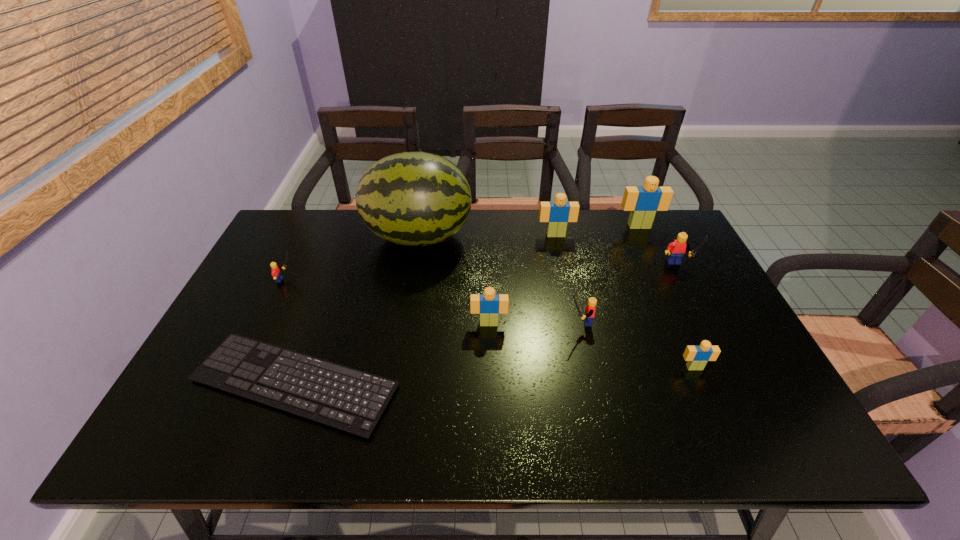
The height and width of the screenshot is (540, 960). Find the location of `free space located 0.280m on the front-facing side of the rightmost yellow Lego`. free space located 0.280m on the front-facing side of the rightmost yellow Lego is located at coordinates (721, 356).

Locate an element on the screen. This screenshot has height=540, width=960. free location located on the face of the sixth object from right to left is located at coordinates (490, 362).

Locate an element on the screen. free point located 0.150m on the front-facing side of the nearest yellow Lego is located at coordinates (508, 322).

Find the location of a particular element. The height and width of the screenshot is (540, 960). vacant space situated 0.300m on the front-facing side of the nearest yellow Lego is located at coordinates (450, 322).

Where is `vacant space situated on the front-facing side of the nearest yellow Lego`? The height and width of the screenshot is (540, 960). vacant space situated on the front-facing side of the nearest yellow Lego is located at coordinates (496, 322).

Where is `free region located on the front-facing side of the smallest yellow Lego`? The width and height of the screenshot is (960, 540). free region located on the front-facing side of the smallest yellow Lego is located at coordinates (316, 280).

Image resolution: width=960 pixels, height=540 pixels. In order to click on vacant space situated 0.050m on the face of the nearest Lego in this screenshot , I will do `click(704, 389)`.

Locate an element on the screen. The height and width of the screenshot is (540, 960). vacant space situated on the back of the computer keyboard is located at coordinates (326, 297).

Image resolution: width=960 pixels, height=540 pixels. In order to click on watermelon positioned at the far edge in this screenshot , I will do `click(410, 198)`.

The width and height of the screenshot is (960, 540). In order to click on object situated at the near edge in this screenshot , I will do `click(345, 398)`.